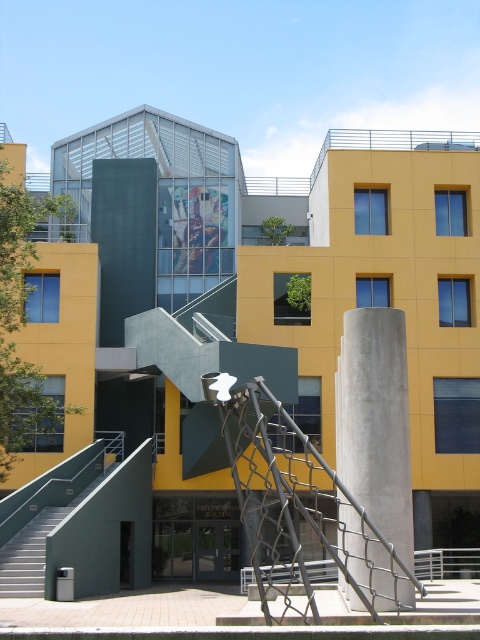
Looking at this image, you are standing at the entrance of the modern architectural structure with the vibrant yellow facade. You notice a point marked at coordinates (375,420). Based on the scene description, where is this point located?

The point at (375,420) is on concrete at center.

From the picture: You are standing at the entrance of the modern building and see two points marked on the ground. The first point is at coordinate point(336, 384) and the second is at point(78, 499). Which point is closer to you as you face the building?

Point(336, 384) is closer to you because it is in front of point(78, 499).